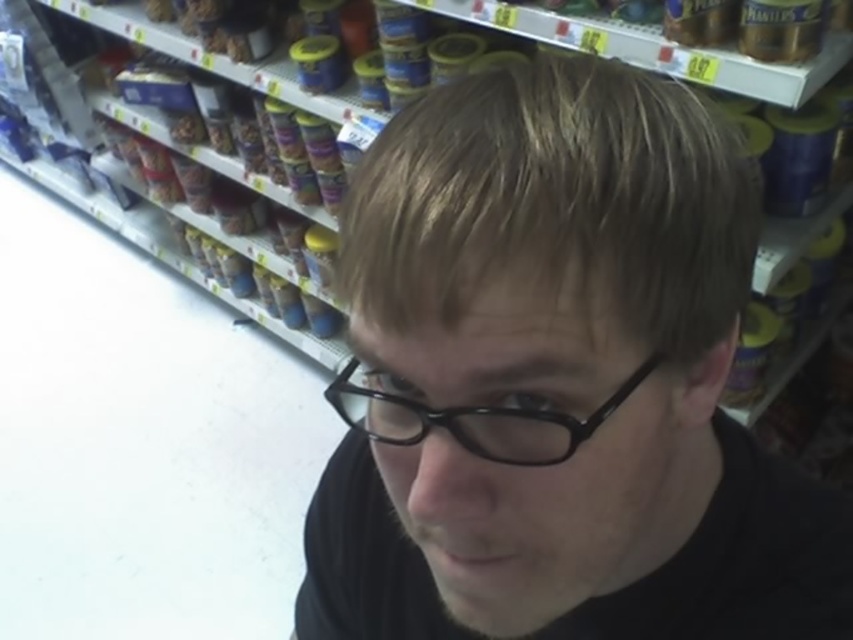
You are standing in a grocery store aisle and see two points marked on the floor. The first point is at coordinate point (457, 502) and the second is at point (271, 124). If you want to walk towards the point that is closer to you, which coordinate should you head towards?

Point (457, 502) is in front of point (271, 124), so you should head towards point (457, 502) as it is closer to your current position.